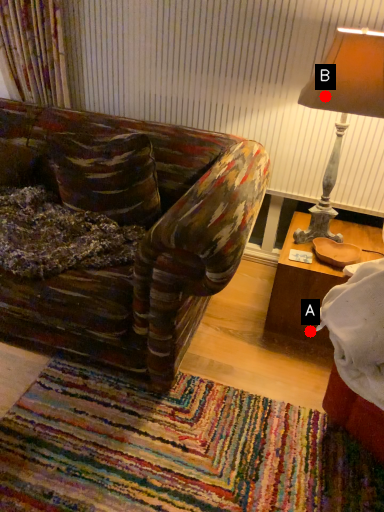
Question: Two points are circled on the image, labeled by A and B beside each circle. Which point is closer to the camera?

Choices:
 (A) A is closer
 (B) B is closer

Answer: (B)